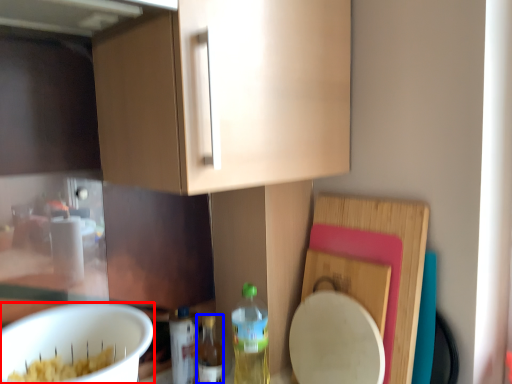
Question: Which of the following is the closest to the observer, mixing bowl (highlighted by a red box) or bottle (highlighted by a blue box)?

Choices:
 (A) mixing bowl
 (B) bottle

Answer: (A)